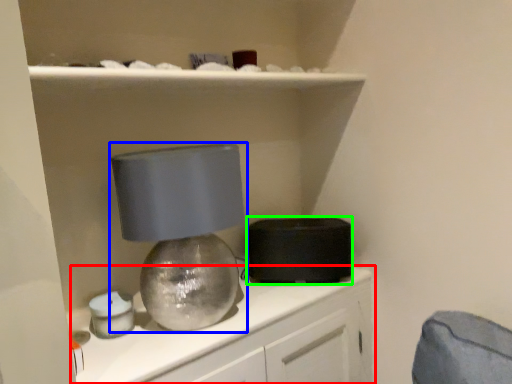
Question: Estimate the real-world distances between objects in this image. Which object is farther from cabinetry (highlighted by a red box), lamp (highlighted by a blue box) or appliance (highlighted by a green box)?

Choices:
 (A) lamp
 (B) appliance

Answer: (A)